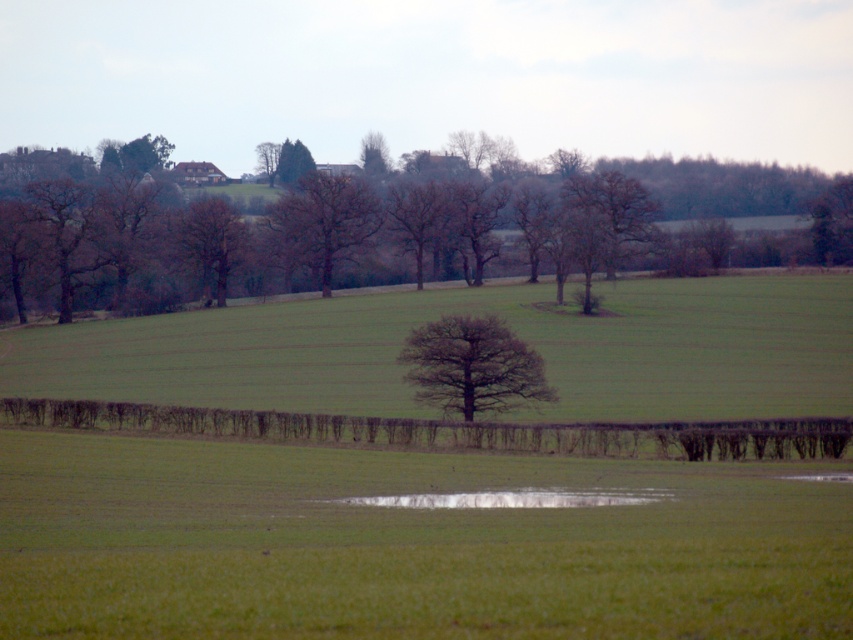
Is point (335, 189) positioned in front of point (328, 294)?

No, it is behind (328, 294).

Which of these two, brown leafless tree at upper center or bare brown tree at center, stands shorter?

bare brown tree at center

The image size is (853, 640). Find the location of `brown leafless tree at upper center`. brown leafless tree at upper center is located at coordinates (375, 225).

Between brown leafless tree at upper center and brown textured tree at center-left, which one has less height?

With less height is brown textured tree at center-left.

Consider the image. Who is positioned more to the right, brown leafless tree at upper center or brown textured tree at center-left?

From the viewer's perspective, brown leafless tree at upper center appears more on the right side.

Locate an element on the screen. The height and width of the screenshot is (640, 853). brown leafless tree at upper center is located at coordinates (375, 225).

Find the location of a particular element. The height and width of the screenshot is (640, 853). brown leafless tree at upper center is located at coordinates (375, 225).

Does brown textured tree at center-left come in front of green leafy tree at upper center?

Yes.

Who is more distant from viewer, (189,237) or (376,177)?

Point (376,177)

Is point (233, 234) positioned in front of point (358, 157)?

Yes, point (233, 234) is in front of point (358, 157).

I want to click on brown textured tree at center-left, so click(210, 244).